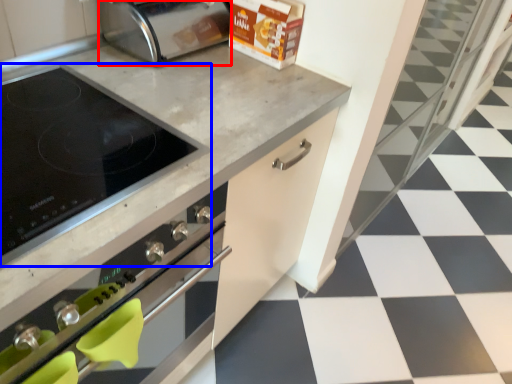
Question: Which object is closer to the camera taking this photo, toaster (highlighted by a red box) or kitchen appliance (highlighted by a blue box)?

Choices:
 (A) toaster
 (B) kitchen appliance

Answer: (B)